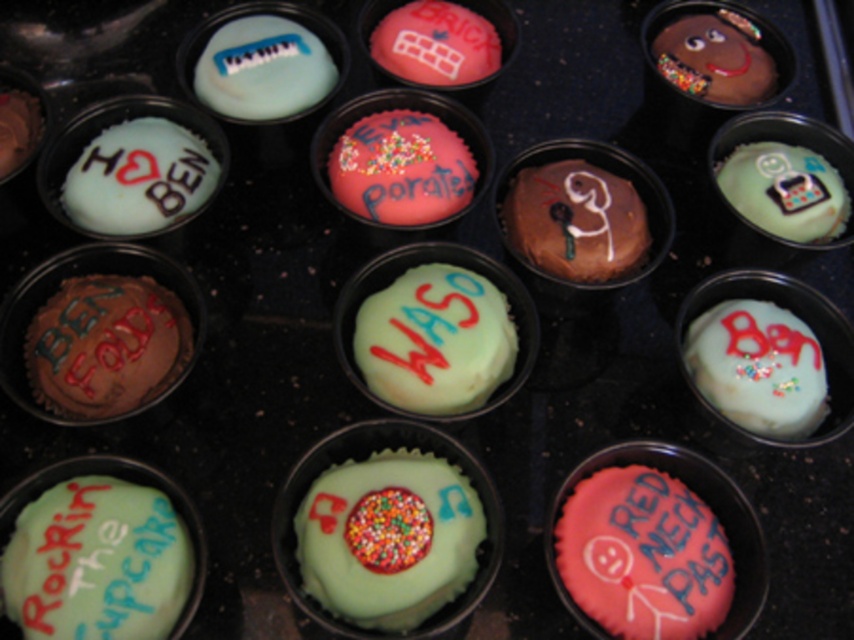
Locate an element on the screen. The image size is (854, 640). brown chocolate cupcake at left is located at coordinates (104, 346).

Who is positioned more to the left, brown chocolate cupcake at left or matte white frosting at upper left?

Positioned to the left is brown chocolate cupcake at left.

Which is in front, point (110, 376) or point (323, 44)?

Point (110, 376) is more forward.

Where is `brown chocolate cupcake at left`? brown chocolate cupcake at left is located at coordinates (104, 346).

Between brown chocolate cupcake at left and pink frosted cupcake at center right, which one appears on the right side from the viewer's perspective?

Positioned to the right is pink frosted cupcake at center right.

Can you confirm if brown chocolate cupcake at left is smaller than pink frosted cupcake at center right?

Yes.

Measure the distance between brown chocolate cupcake at left and camera.

The distance of brown chocolate cupcake at left from camera is 35.73 inches.

You are a GUI agent. You are given a task and a screenshot of the screen. Output one action in this format:
    pyautogui.click(x=<x>, y=<y>)
    Task: Click on the brown chocolate cupcake at left
    Image resolution: width=854 pixels, height=640 pixels.
    Given the screenshot: What is the action you would take?
    pyautogui.click(x=104, y=346)

Between matte white frosting at upper left and pink frosted cupcake at center right, which one has more height?

pink frosted cupcake at center right

Between point (305, 97) and point (756, 580), which one is positioned behind?

The point (305, 97) is more distant.

What are the coordinates of `matte white frosting at upper left` in the screenshot? It's located at (262, 68).